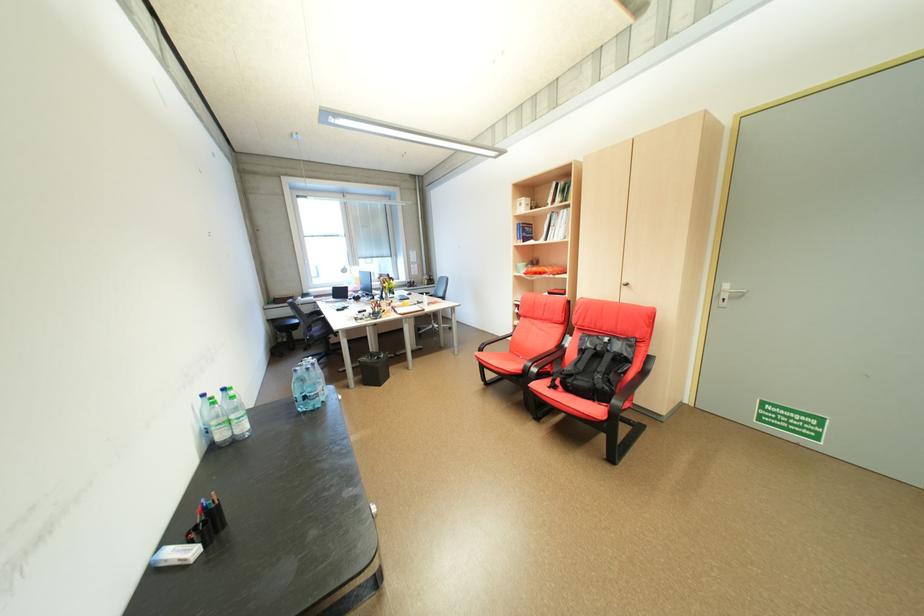
You are a GUI agent. You are given a task and a screenshot of the screen. Output one action in this format:
    pyautogui.click(x=<x>, y=<y>)
    Task: Click on the silver cabinet knob
    
    Given the screenshot: What is the action you would take?
    pyautogui.click(x=372, y=509)